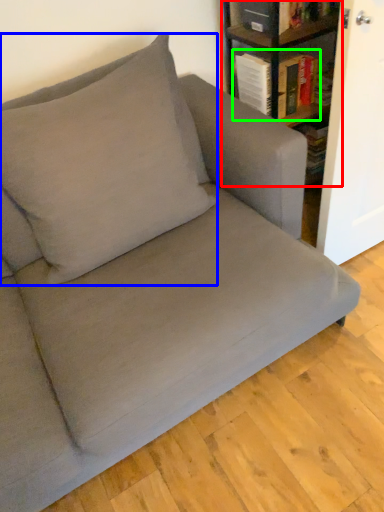
Question: Which object is the farthest from shelf (highlighted by a red box)? Choose among these: throw pillow (highlighted by a blue box) or book (highlighted by a green box).

Choices:
 (A) throw pillow
 (B) book

Answer: (A)